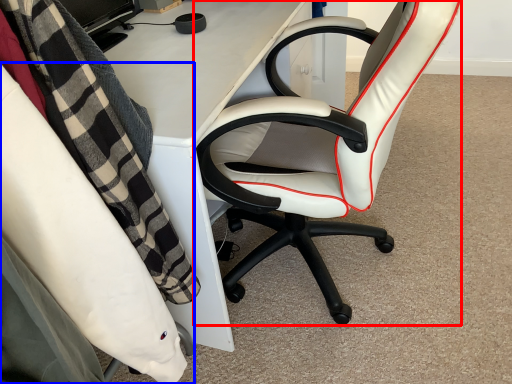
Question: Which of the following is the farthest to the observer, chair (highlighted by a red box) or chair (highlighted by a blue box)?

Choices:
 (A) chair
 (B) chair

Answer: (A)